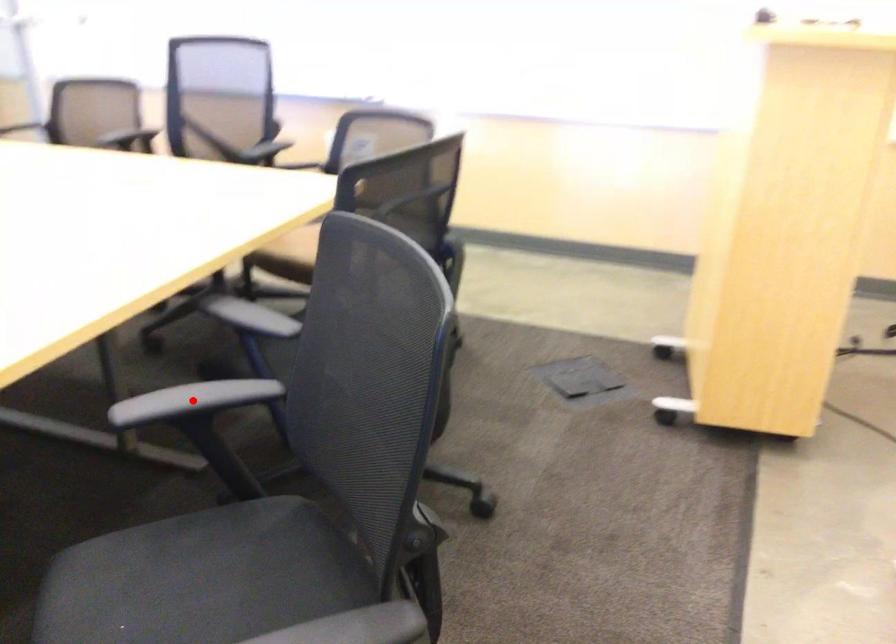
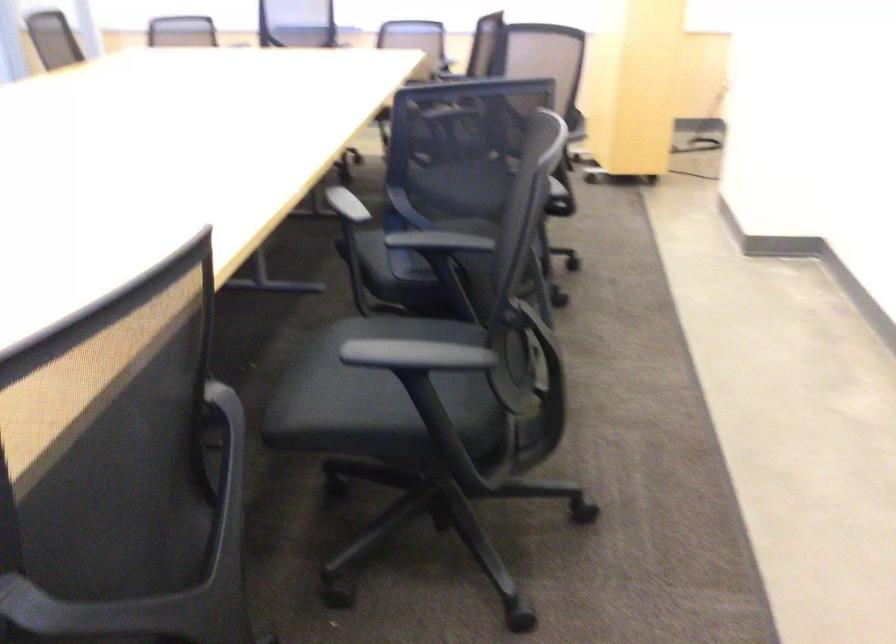
Question: I am providing you with two images of the same scene from different viewpoints. A red point is marked on the first image. Can you still see the location of the red point in image 2?

Choices:
 (A) Yes
 (B) No

Answer: (B)